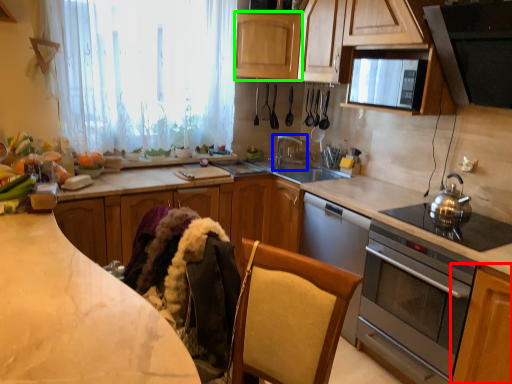
Question: Which object is positioned closest to cabinetry (highlighted by a red box)? Select from tap (highlighted by a blue box) and cabinetry (highlighted by a green box).

Choices:
 (A) tap
 (B) cabinetry

Answer: (A)